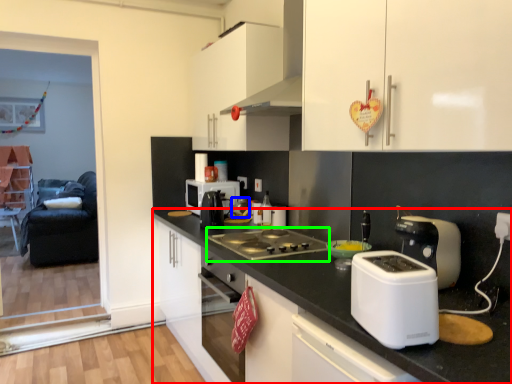
Question: Which object is positioned closest to countertop (highlighted by a red box)? Select from appliance (highlighted by a blue box) and gas stove (highlighted by a green box).

Choices:
 (A) appliance
 (B) gas stove

Answer: (B)